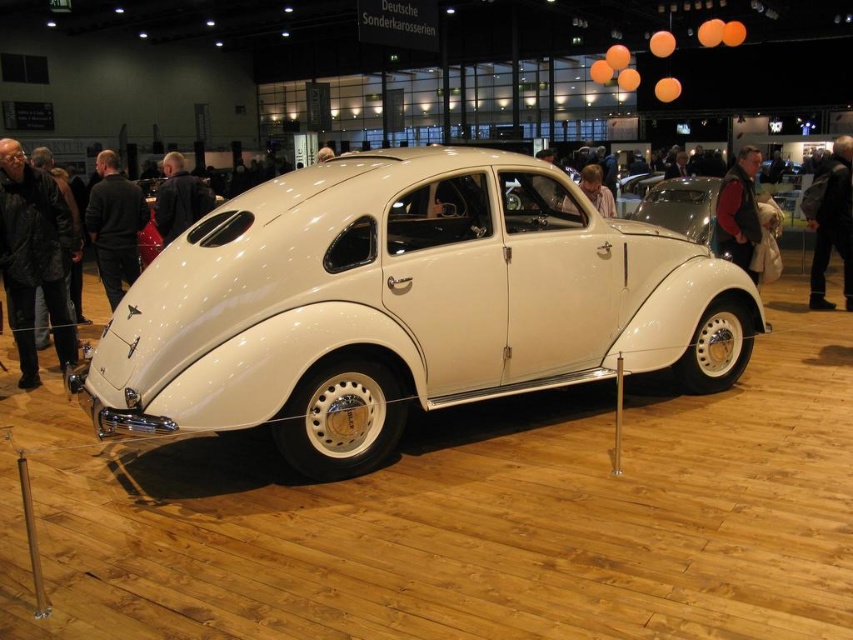
Image resolution: width=853 pixels, height=640 pixels. What are the coordinates of `black leather jacket at left` in the screenshot? It's located at click(33, 257).

Who is lower down, black leather jacket at center or matte white car at center?

black leather jacket at center is below.

Does black leather jacket at center have a larger size compared to matte white car at center?

Actually, black leather jacket at center might be smaller than matte white car at center.

Which is in front, point (109, 157) or point (599, 193)?

Point (109, 157)

Identify the location of black leather jacket at center. (114, 225).

Does point (534, 252) lie in front of point (750, 208)?

Yes.

Does white matte car at center have a lesser width compared to dark red leather jacket at center?

No, white matte car at center is not thinner than dark red leather jacket at center.

What do you see at coordinates (405, 305) in the screenshot?
I see `white matte car at center` at bounding box center [405, 305].

This screenshot has width=853, height=640. Identify the location of white matte car at center. (405, 305).